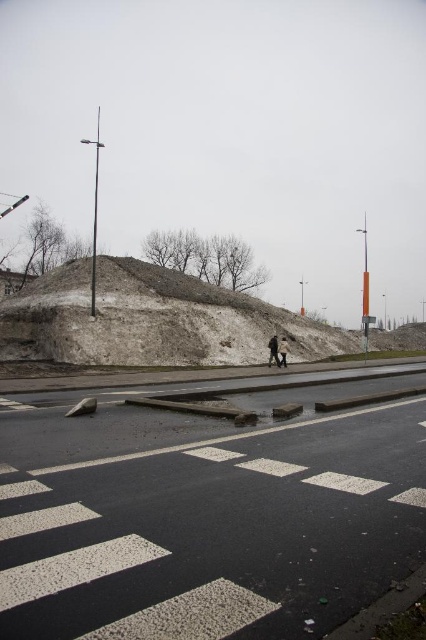
Who is lower down, gray textured dirt at center or light brown leather jacket at center?

light brown leather jacket at center is below.

Does gray textured dirt at center lie behind light brown leather jacket at center?

No, gray textured dirt at center is closer to the viewer.

Identify the location of gray textured dirt at center. (152, 321).

Does gray textured dirt at center have a lesser width compared to dark gray fabric coat at center?

In fact, gray textured dirt at center might be wider than dark gray fabric coat at center.

Consider the image. Is gray textured dirt at center to the left of dark gray fabric coat at center from the viewer's perspective?

No, gray textured dirt at center is not to the left of dark gray fabric coat at center.

This screenshot has height=640, width=426. What are the coordinates of `gray textured dirt at center` in the screenshot? It's located at (152, 321).

Is light brown leather jacket at center above dark gray fabric coat at center?

Yes, light brown leather jacket at center is above dark gray fabric coat at center.

Between point (275, 355) and point (282, 353), which one is positioned behind?

The point (275, 355) is behind.

Describe the element at coordinates (273, 349) in the screenshot. I see `light brown leather jacket at center` at that location.

I want to click on light brown leather jacket at center, so click(x=273, y=349).